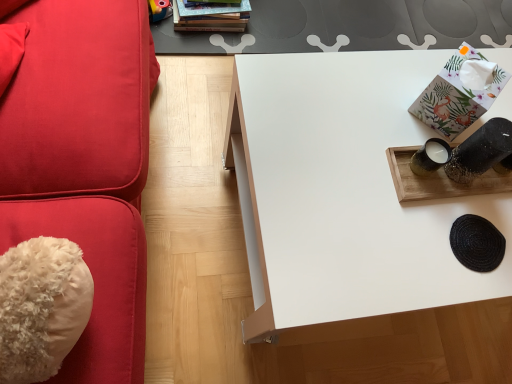
Question: From a real-world perspective, relative to floral paper tissue at upper right, is white matte table at center vertically above or below?

Choices:
 (A) above
 (B) below

Answer: (B)

Question: From the image's perspective, is white matte table at center located above or below floral paper tissue at upper right?

Choices:
 (A) above
 (B) below

Answer: (B)

Question: Which of these objects is positioned farthest from the floral paper tissue at upper right?

Choices:
 (A) hardcover books at upper center
 (B) white matte table at center

Answer: (A)

Question: Considering the real-world distances, which object is closest to the hardcover books at upper center?

Choices:
 (A) floral paper tissue at upper right
 (B) white matte table at center

Answer: (B)